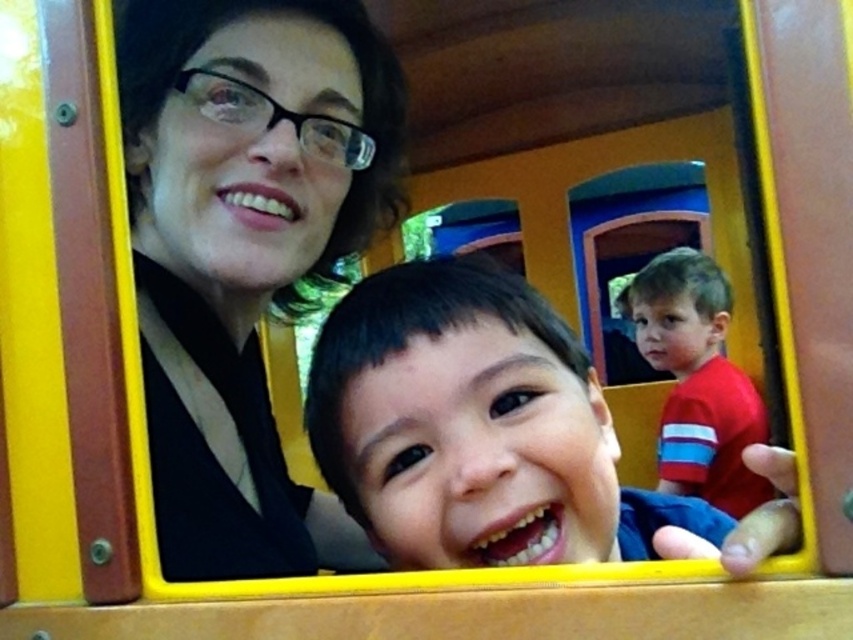
The width and height of the screenshot is (853, 640). Identify the location of smooth skin face at center. (495, 435).

Who is positioned more to the right, smooth skin face at center or red smooth shirt at right?

Positioned to the right is red smooth shirt at right.

The width and height of the screenshot is (853, 640). What are the coordinates of `smooth skin face at center` in the screenshot? It's located at (495, 435).

Between matte black hair at upper left and smooth skin face at center, which one has more height?

matte black hair at upper left

Can you confirm if matte black hair at upper left is wider than smooth skin face at center?

Incorrect, matte black hair at upper left's width does not surpass smooth skin face at center's.

Is point (189, 541) positioned behind point (375, 340)?

That is True.

Where is `matte black hair at upper left`? The width and height of the screenshot is (853, 640). matte black hair at upper left is located at coordinates (242, 256).

Who is positioned more to the right, matte black hair at upper left or red smooth shirt at right?

Positioned to the right is red smooth shirt at right.

Does matte black hair at upper left have a greater height compared to red smooth shirt at right?

No.

You are a GUI agent. You are given a task and a screenshot of the screen. Output one action in this format:
    pyautogui.click(x=<x>, y=<y>)
    Task: Click on the matte black hair at upper left
    The width and height of the screenshot is (853, 640).
    Given the screenshot: What is the action you would take?
    pyautogui.click(x=242, y=256)

The image size is (853, 640). I want to click on matte black hair at upper left, so pyautogui.click(x=242, y=256).